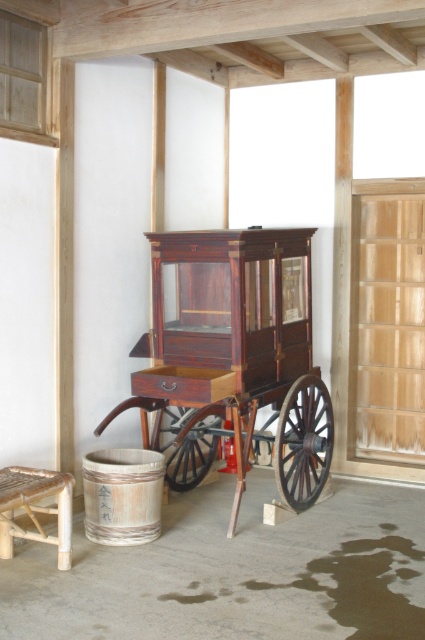
Question: Which point appears farthest from the camera in this image?

Choices:
 (A) (65, 529)
 (B) (163, 369)

Answer: (B)

Question: Does mahogany wood wagon at center come behind bamboo stool at lower left?

Choices:
 (A) yes
 (B) no

Answer: (A)

Question: Which point is farther from the camera taking this photo?

Choices:
 (A) (59, 474)
 (B) (237, 404)

Answer: (B)

Question: In this image, where is mahogany wood wagon at center located relative to bamboo stool at lower left?

Choices:
 (A) left
 (B) right

Answer: (B)

Question: Is mahogany wood wagon at center positioned at the back of bamboo stool at lower left?

Choices:
 (A) yes
 (B) no

Answer: (A)